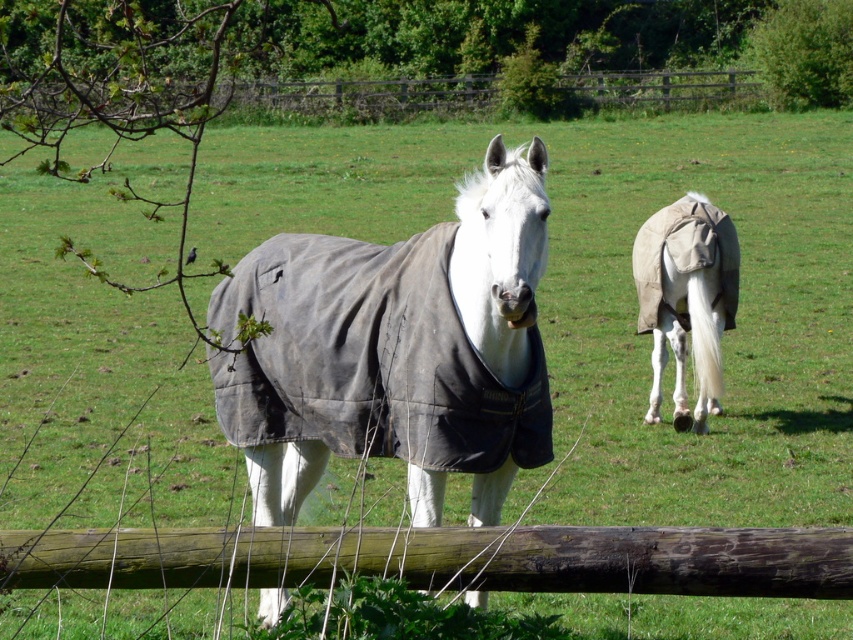
Question: Considering the relative positions of white clothed horse at center and wooden fence at upper center in the image provided, where is white clothed horse at center located with respect to wooden fence at upper center?

Choices:
 (A) left
 (B) right

Answer: (B)

Question: Is white clothed horse at center below wooden fence at upper center?

Choices:
 (A) no
 (B) yes

Answer: (B)

Question: In this image, where is wooden fence at upper center located relative to white cloth-covered horse at center?

Choices:
 (A) right
 (B) left

Answer: (B)

Question: Among these objects, which one is nearest to the camera?

Choices:
 (A) wooden fence at upper center
 (B) white cloth-covered horse at center
 (C) white clothed horse at center

Answer: (A)

Question: Which point is closer to the camera?

Choices:
 (A) white clothed horse at center
 (B) wooden fence at upper center
 (C) white cloth-covered horse at center

Answer: (B)

Question: Among these objects, which one is farthest from the camera?

Choices:
 (A) wooden fence at upper center
 (B) white cloth-covered horse at center

Answer: (B)